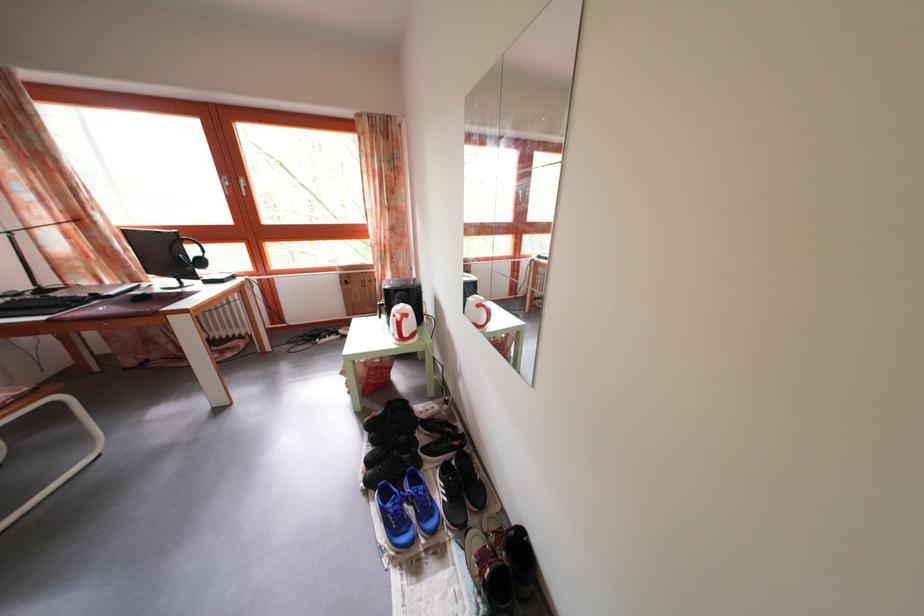
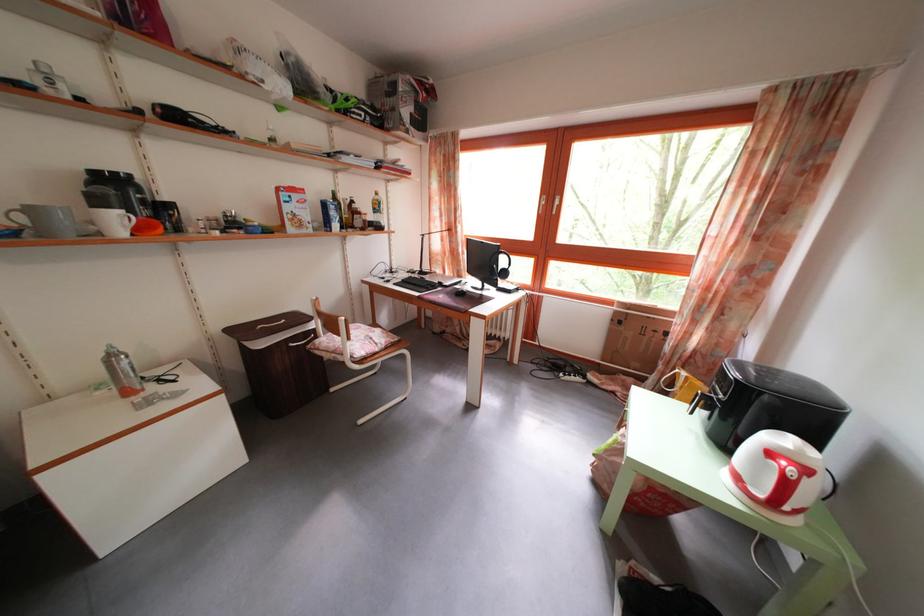
Find the pixel in the second image that matches point 117,304 in the first image.

(454, 294)